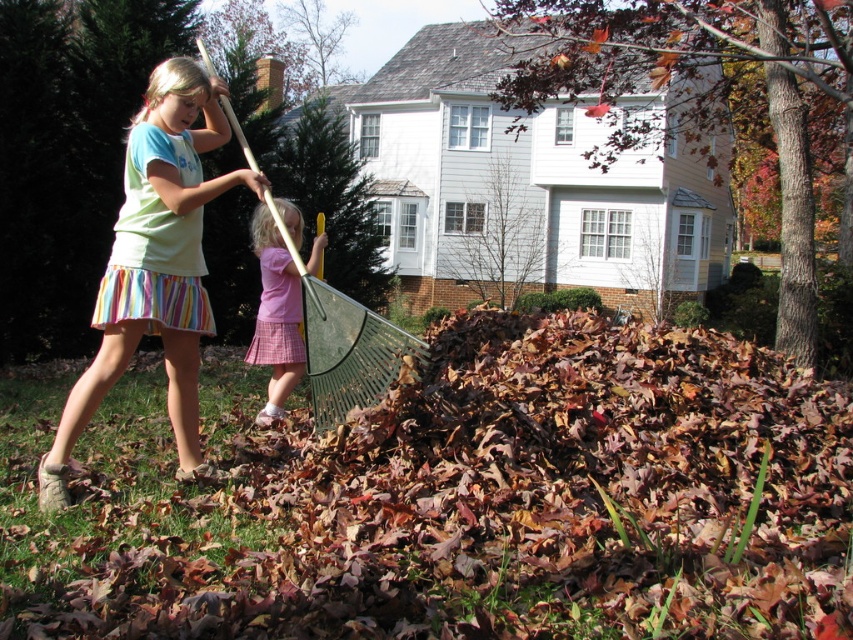
Measure the distance between light green cotton shirt at center and green plastic shovel at center.

light green cotton shirt at center and green plastic shovel at center are 97.53 centimeters apart.

Is point (178, 132) positioned in front of point (375, 316)?

Yes.

Does point (196, 168) come behind point (318, 368)?

No, it is not.

At what (x,y) coordinates should I click in order to perform the action: click on light green cotton shirt at center. Please return your answer as a coordinate pair (x, y). The width and height of the screenshot is (853, 640). Looking at the image, I should click on (155, 264).

Is the position of brown dry leaves at center more distant than that of pink plaid skirt at center?

No, it is not.

Is brown dry leaves at center below pink plaid skirt at center?

Indeed, brown dry leaves at center is positioned under pink plaid skirt at center.

Between point (65, 563) and point (279, 413), which one is positioned behind?

The point (279, 413) is behind.

Identify the location of brown dry leaves at center. This screenshot has height=640, width=853. (492, 504).

Is point (317, 392) closer to viewer compared to point (280, 387)?

That is True.

Between green plastic shovel at center and pink plaid skirt at center, which one is positioned lower?

Positioned lower is pink plaid skirt at center.

The image size is (853, 640). Describe the element at coordinates (341, 340) in the screenshot. I see `green plastic shovel at center` at that location.

I want to click on green plastic shovel at center, so click(x=341, y=340).